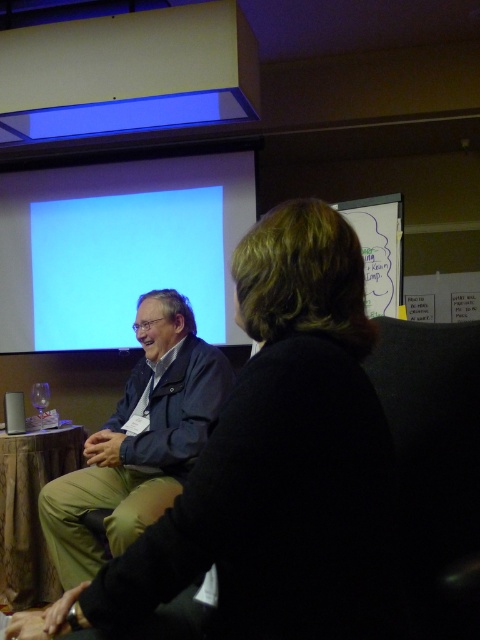
Question: Which point is farther from the camera taking this photo?

Choices:
 (A) (164, 394)
 (B) (201, 333)
 (C) (34, 586)

Answer: (B)

Question: Is dark blue jacket at center below wooden at left?

Choices:
 (A) yes
 (B) no

Answer: (B)

Question: Considering the real-world distances, which object is farthest from the wooden at left?

Choices:
 (A) black fabric jacket at center
 (B) light blue matte projection screen at upper center
 (C) dark blue jacket at center

Answer: (A)

Question: Does light blue matte projection screen at upper center have a smaller size compared to dark blue jacket at center?

Choices:
 (A) no
 (B) yes

Answer: (B)

Question: Estimate the real-world distances between objects in this image. Which object is closer to the light blue matte projection screen at upper center?

Choices:
 (A) black fabric jacket at center
 (B) dark blue jacket at center
 (C) wooden at left

Answer: (C)

Question: From the image, what is the correct spatial relationship of light blue matte projection screen at upper center in relation to dark blue jacket at center?

Choices:
 (A) left
 (B) right

Answer: (A)